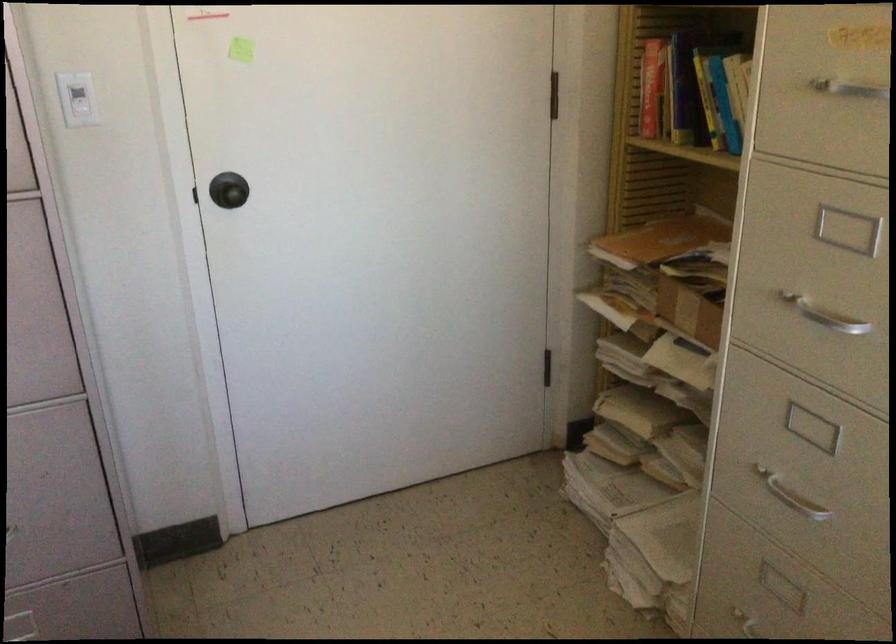
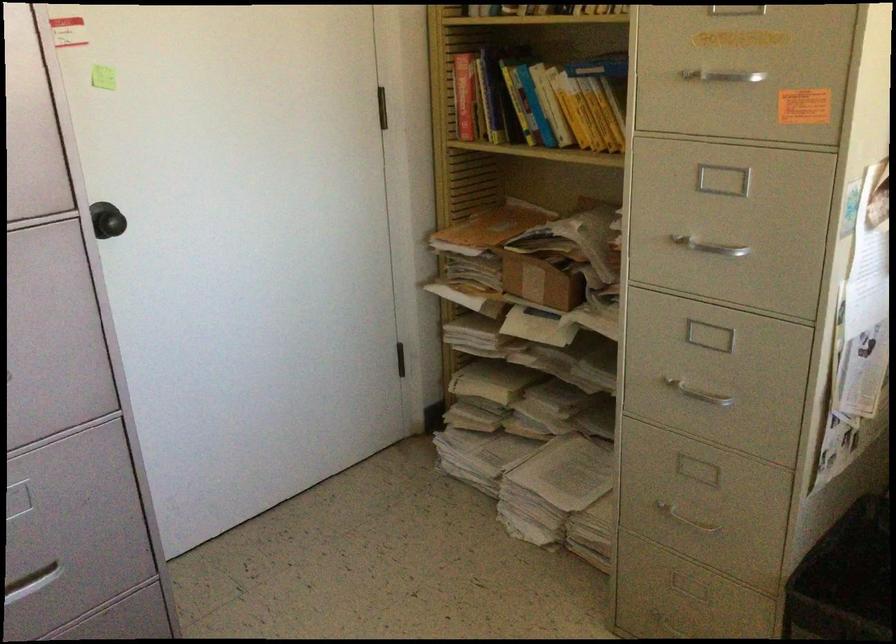
The point at (x=708, y=109) is marked in the first image. Where is the corresponding point in the second image?

(523, 111)